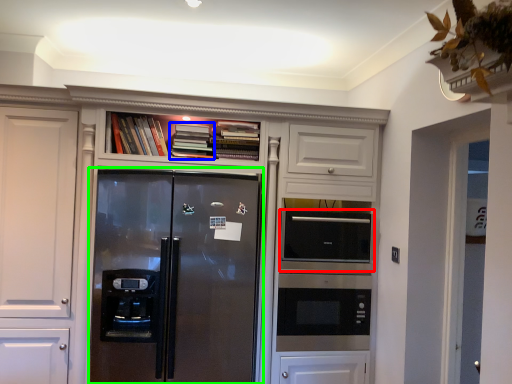
Question: Which object is the farthest from appliance (highlighted by a red box)? Choose among these: book (highlighted by a blue box) or refrigerator (highlighted by a green box).

Choices:
 (A) book
 (B) refrigerator

Answer: (A)